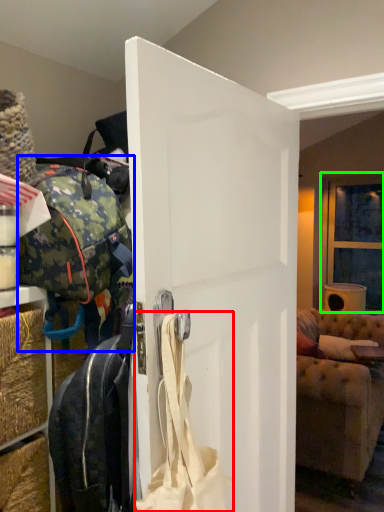
Question: Considering the real-world distances, which object is farthest from shoulder bag (highlighted by a red box)? luggage and bags (highlighted by a blue box) or window (highlighted by a green box)?

Choices:
 (A) luggage and bags
 (B) window

Answer: (B)